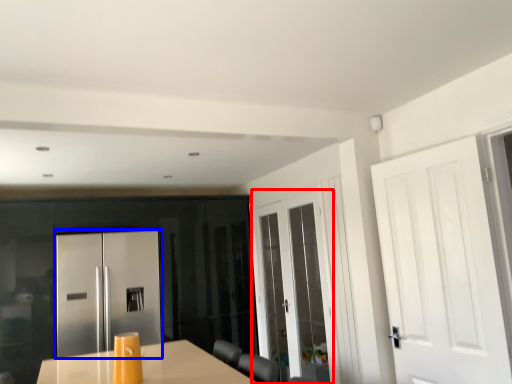
Question: Which of the following is the closest to the observer, door (highlighted by a red box) or door (highlighted by a blue box)?

Choices:
 (A) door
 (B) door

Answer: (A)